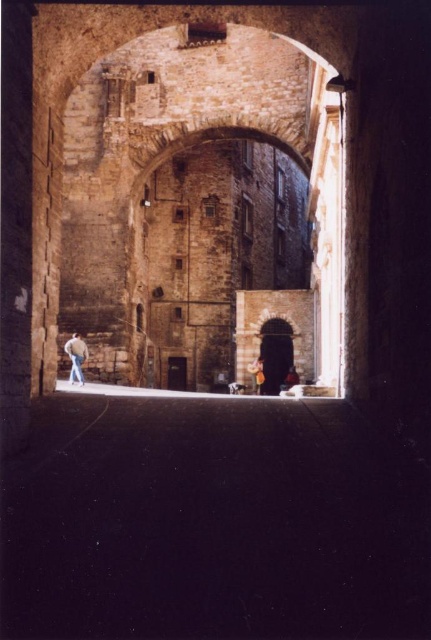
Between dark stone alley at center and light brown leather jacket at left, which one is positioned lower?

Positioned lower is dark stone alley at center.

I want to click on dark stone alley at center, so pos(211,522).